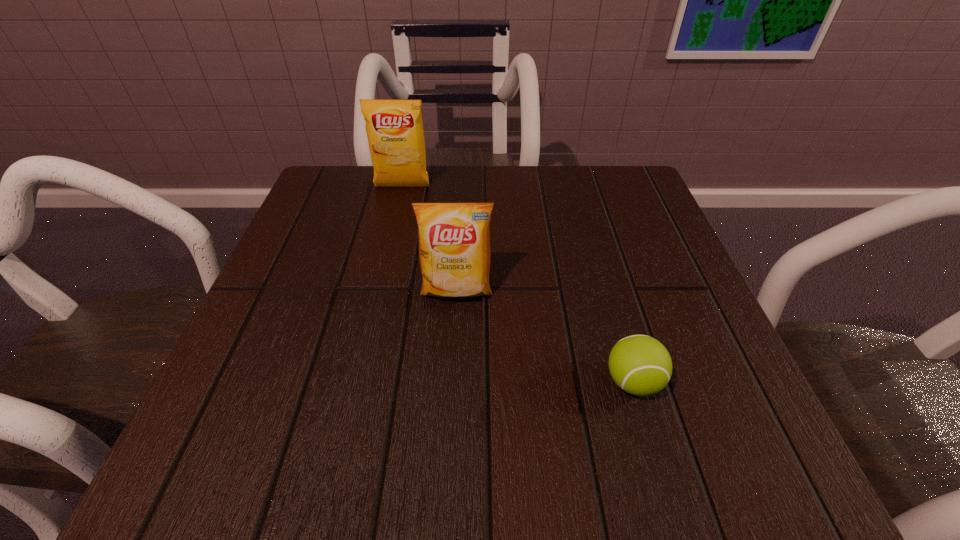
You are a GUI agent. You are given a task and a screenshot of the screen. Output one action in this format:
    pyautogui.click(x=<x>, y=<y>)
    Task: Click on the object at the left edge
    This screenshot has height=540, width=960.
    Given the screenshot: What is the action you would take?
    pyautogui.click(x=394, y=128)

Locate an element on the screen. object situated at the right edge is located at coordinates (640, 365).

You are a GUI agent. You are given a task and a screenshot of the screen. Output one action in this format:
    pyautogui.click(x=<x>, y=<y>)
    Task: Click on the object that is positioned at the far left corner
    
    Given the screenshot: What is the action you would take?
    pyautogui.click(x=394, y=128)

Image resolution: width=960 pixels, height=540 pixels. Identify the location of vacant point at the far edge. (502, 225).

Locate an element on the screen. The height and width of the screenshot is (540, 960). blank space at the near edge of the desktop is located at coordinates (570, 442).

At what (x,y) coordinates should I click in order to perform the action: click on free space at the left edge of the desktop. Please return your answer as a coordinate pair (x, y). This screenshot has height=540, width=960. Looking at the image, I should click on (271, 407).

Where is `vacant space at the right edge of the desktop`? vacant space at the right edge of the desktop is located at coordinates (724, 384).

Locate an element on the screen. The height and width of the screenshot is (540, 960). blank space at the far left corner of the desktop is located at coordinates (351, 216).

Where is `free location at the far right corner of the desktop`? The image size is (960, 540). free location at the far right corner of the desktop is located at coordinates (581, 206).

In the image, there is a desktop. Identify the location of vacant space at the near right corner. (703, 429).